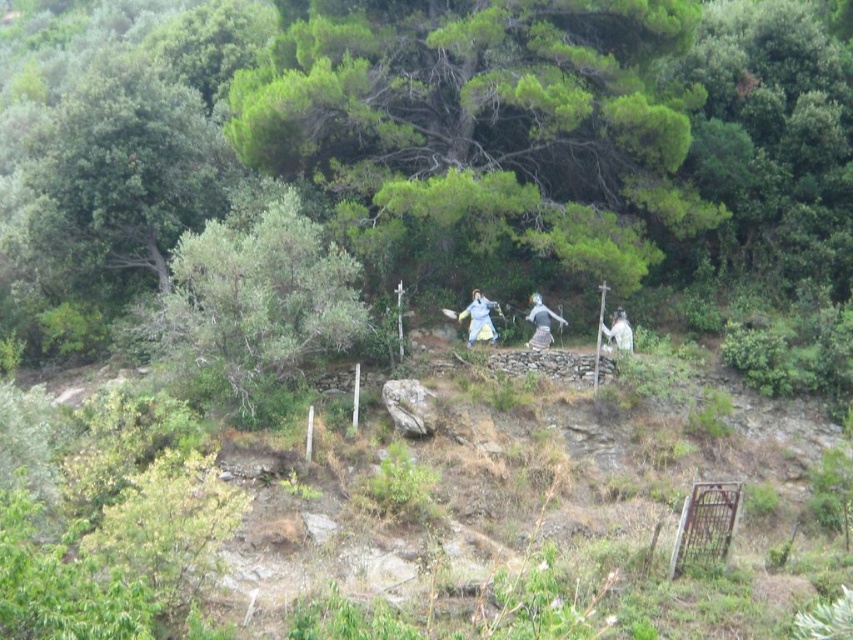
Question: Which point is closer to the camera taking this photo?

Choices:
 (A) pos(288,300)
 (B) pos(624,316)
 (C) pos(473,317)
 (D) pos(552,317)

Answer: (A)

Question: Among these objects, which one is nearest to the camera?

Choices:
 (A) metallic silver statue at center
 (B) green leafy tree at center

Answer: (B)

Question: Is green leafy tree at center bigger than white matte statue at center?

Choices:
 (A) no
 (B) yes

Answer: (B)

Question: Is green leafy tree at center below metallic silver statue at center?

Choices:
 (A) no
 (B) yes

Answer: (A)

Question: Which point appears farthest from the camera in this image?

Choices:
 (A) (624, 348)
 (B) (172, 355)

Answer: (A)

Question: Does matte white statue at center appear on the right side of metallic silver statue at center?

Choices:
 (A) yes
 (B) no

Answer: (B)